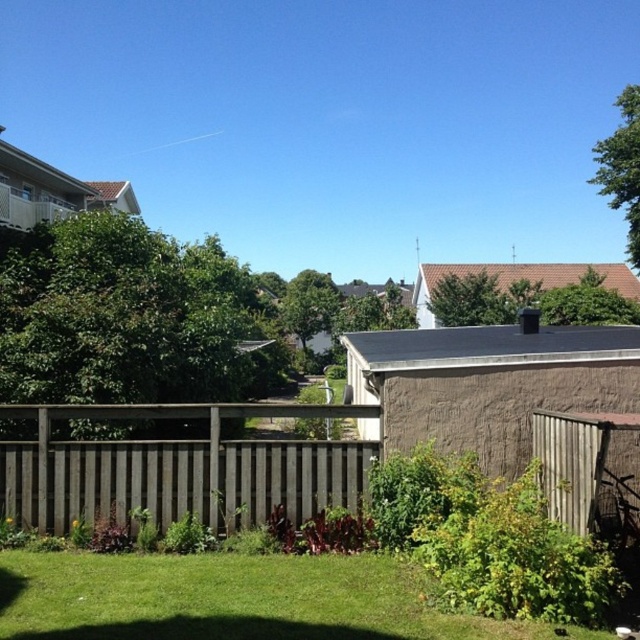
Question: Which of the following is the farthest from the observer?

Choices:
 (A) weathered wood fence at center
 (B) green grass at lower center

Answer: (A)

Question: Is green grass at lower center to the left of weathered wood fence at center from the viewer's perspective?

Choices:
 (A) no
 (B) yes

Answer: (A)

Question: Is green grass at lower center closer to the viewer compared to weathered wood fence at center?

Choices:
 (A) yes
 (B) no

Answer: (A)

Question: Among these objects, which one is farthest from the camera?

Choices:
 (A) weathered wood fence at center
 (B) green grass at lower center

Answer: (A)

Question: Does green grass at lower center have a lesser width compared to weathered wood fence at center?

Choices:
 (A) no
 (B) yes

Answer: (A)

Question: Which point appears closest to the camera in this image?

Choices:
 (A) (177, 416)
 (B) (166, 605)

Answer: (B)